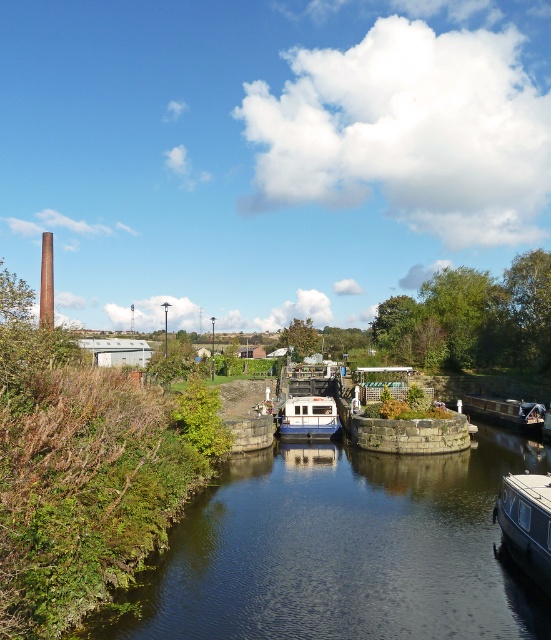
Question: Is white glossy boat at lower right to the left of white glossy boat at center from the viewer's perspective?

Choices:
 (A) yes
 (B) no

Answer: (B)

Question: Which object is the closest to the dark green water at center?

Choices:
 (A) white glossy boat at center
 (B) white glossy boat at lower right

Answer: (B)

Question: Which of the following is the closest to the observer?

Choices:
 (A) white glossy boat at center
 (B) white glossy boat at lower right

Answer: (B)

Question: From the image, what is the correct spatial relationship of white glossy boat at lower right in relation to white glossy boat at center?

Choices:
 (A) above
 (B) below

Answer: (A)

Question: Is white glossy boat at lower right to the left of white glossy boat at center from the viewer's perspective?

Choices:
 (A) no
 (B) yes

Answer: (A)

Question: Which of the following is the closest to the observer?

Choices:
 (A) (309, 397)
 (B) (521, 563)
 (C) (479, 593)

Answer: (C)